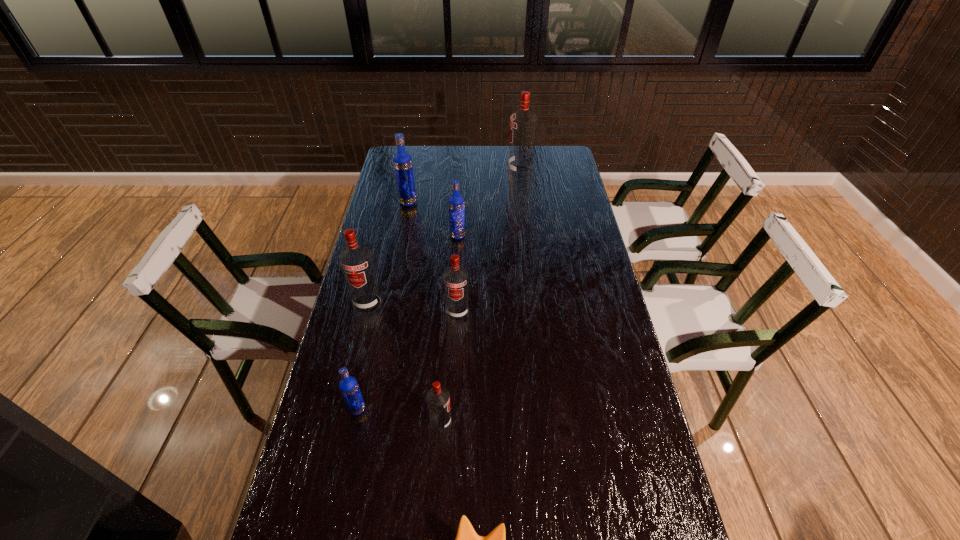
At what (x,y) coordinates should I click in order to perform the action: click on free space that satisfies the following two spatial constraints: 1. on the front label of the rightmost red vodka; 2. on the front side of the biggest blue vodka. Please return your answer as a coordinate pair (x, y). Looking at the image, I should click on (523, 202).